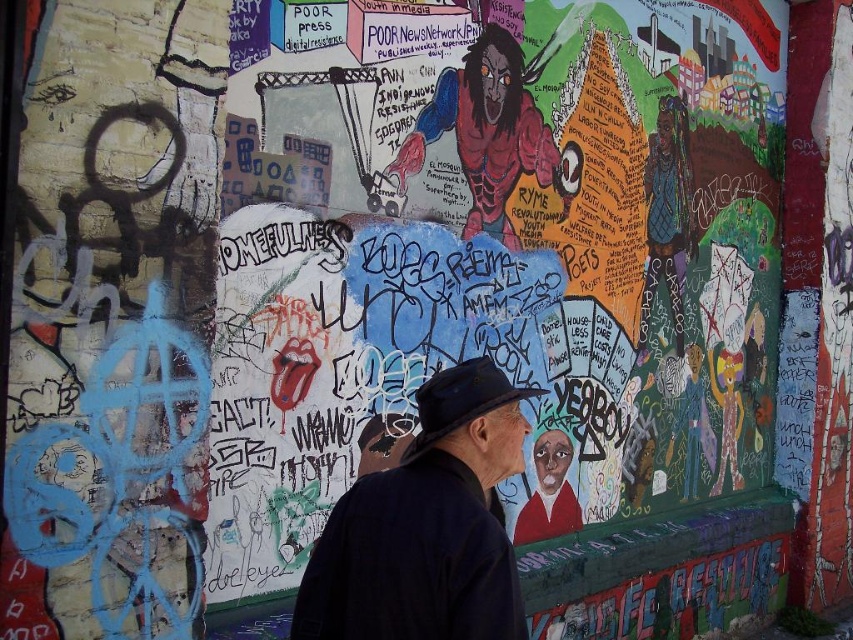
Consider the image. You are an urban explorer carrying a backpack. You spot a dark blue fabric jacket at center and a black felt hat at center on the graffiti wall. Can your backpack fit both items if you place them side by side?

The dark blue fabric jacket at center might be wider than the black felt hat at center, so placing them side by side may exceed the backpack width. Check the jacket and hat dimensions first.

Consider the image. You are an urban explorer examining the graffiti wall. You notice a dark blue fabric jacket at center and a matte black hat at center. Which object is closer to you on the wall?

The dark blue fabric jacket at center is closer to you because it is in front of the matte black hat at center.

You are standing in front of an urban wall covered with graffiti. You see a dark blue fabric jacket at center. Can you reach the jacket with your outstretched hand?

The dark blue fabric jacket at center is 6.08 feet away from you, so you cannot reach it with your outstretched hand since the average human arm length is about 2.5 feet.